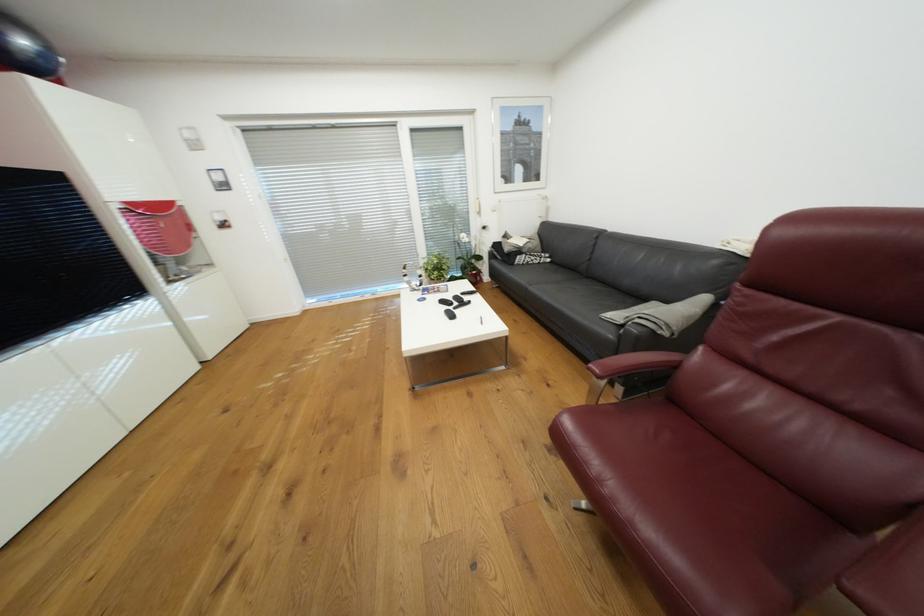
Locate an element on the screen. This screenshot has height=616, width=924. sofa armrest is located at coordinates (890, 573).